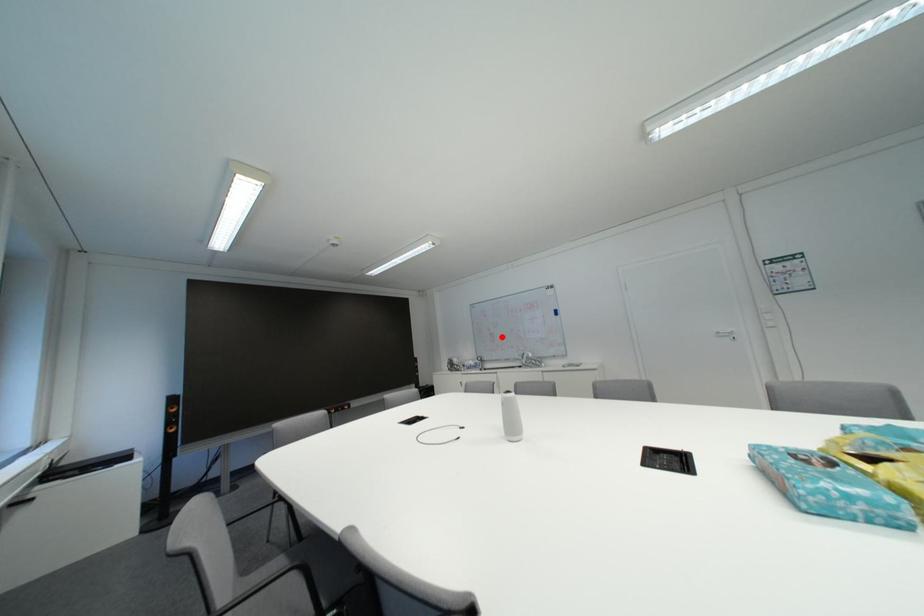
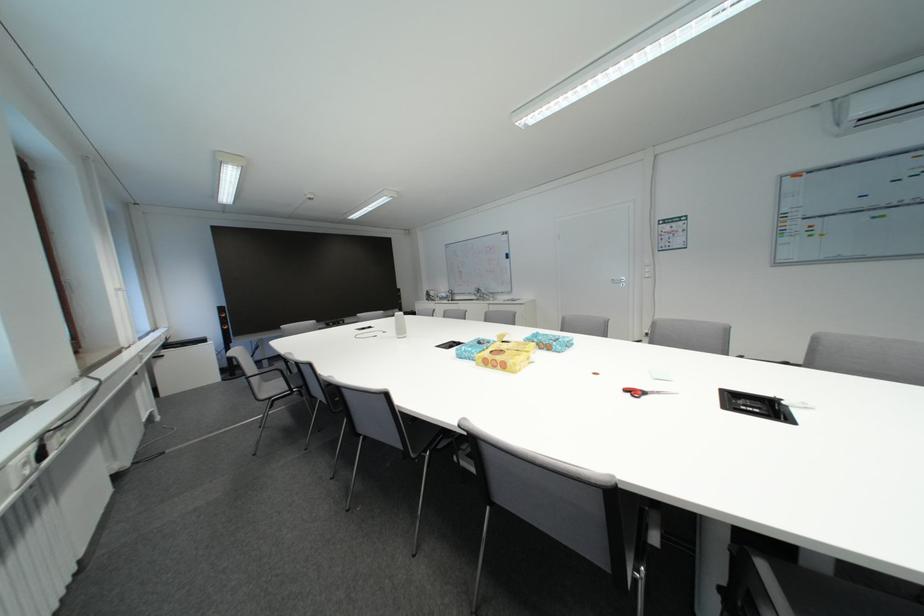
In the second image, find the point that corresponds to the highlighted location in the first image.

(470, 275)